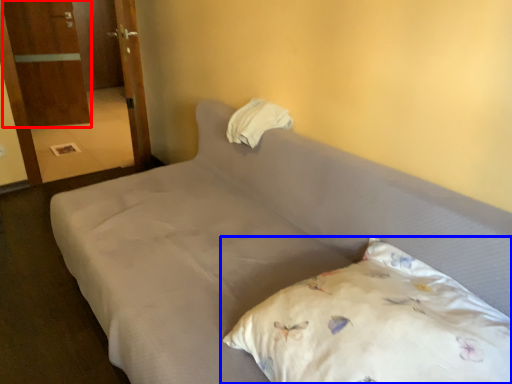
Question: Which object appears farthest to the camera in this image, armoire (highlighted by a red box) or pillow (highlighted by a blue box)?

Choices:
 (A) armoire
 (B) pillow

Answer: (A)